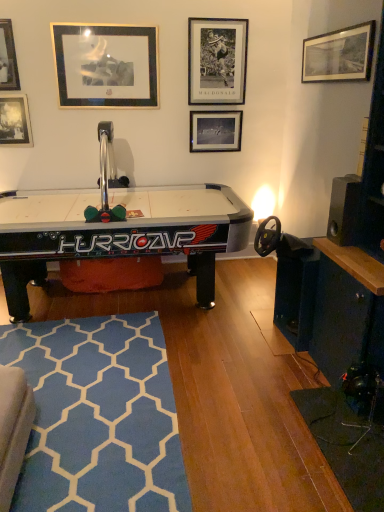
Measure the distance between point (12, 96) and camera.

The distance of point (12, 96) from camera is 11.77 feet.

At what (x,y) coordinates should I click in order to perform the action: click on blue textured rug at lower left. Please return your answer as a coordinate pair (x, y). This screenshot has width=384, height=512. Looking at the image, I should click on (98, 416).

What is the approximate width of black glossy air hockey table at center?

black glossy air hockey table at center is 1.28 meters wide.

How much space does black matte picture frame at center, which ranks as the third picture frame in right-to-left order, occupy vertically?

The height of black matte picture frame at center, which ranks as the third picture frame in right-to-left order, is 37.36 centimeters.

Image resolution: width=384 pixels, height=512 pixels. I want to click on metallic silver picture frame at upper center, placed as the 5th picture frame when sorted from left to right, so click(x=217, y=61).

Is black glossy air hockey table at center shorter than metallic silver picture frame at upper left, positioned as the 2th picture frame in left-to-right order?

No.

From a real-world perspective, does black glossy air hockey table at center stand above metallic silver picture frame at upper left, marked as the fifth picture frame in a right-to-left arrangement?

No.

Is black glossy air hockey table at center placed right next to metallic silver picture frame at upper left, positioned as the 2th picture frame in left-to-right order?

No, black glossy air hockey table at center is not with metallic silver picture frame at upper left, positioned as the 2th picture frame in left-to-right order.

From the image's perspective, which object appears higher, black glossy air hockey table at center or metallic silver picture frame at upper left, marked as the fifth picture frame in a right-to-left arrangement?

metallic silver picture frame at upper left, marked as the fifth picture frame in a right-to-left arrangement, from the image's perspective.

Is metallic silver picture frame at upper left, positioned as the 2th picture frame in left-to-right order, oriented towards gold/metallic picture frame at upper left, which is the 4th picture frame in right-to-left order?

No, metallic silver picture frame at upper left, positioned as the 2th picture frame in left-to-right order, is not aimed at gold/metallic picture frame at upper left, which is the 4th picture frame in right-to-left order.

Is metallic silver picture frame at upper left, positioned as the 2th picture frame in left-to-right order, at the right side of gold/metallic picture frame at upper left, the third picture frame from the left?

Incorrect, metallic silver picture frame at upper left, positioned as the 2th picture frame in left-to-right order, is not on the right side of gold/metallic picture frame at upper left, the third picture frame from the left.

Who is bigger, metallic silver picture frame at upper left, marked as the fifth picture frame in a right-to-left arrangement, or gold/metallic picture frame at upper left, which is the 4th picture frame in right-to-left order?

With larger size is gold/metallic picture frame at upper left, which is the 4th picture frame in right-to-left order.

Is metallic silver picture frame at upper center, placed as the 2th picture frame when sorted from right to left, not inside metallic silver picture frame at upper left, arranged as the first picture frame when viewed from the left?

Yes, metallic silver picture frame at upper center, placed as the 2th picture frame when sorted from right to left, is located beyond the bounds of metallic silver picture frame at upper left, arranged as the first picture frame when viewed from the left.

How many degrees apart are the facing directions of metallic silver picture frame at upper center, placed as the 5th picture frame when sorted from left to right, and metallic silver picture frame at upper left, which is the 6th picture frame from right to left?

0.0104 degrees.

Is point (236, 19) more distant than point (20, 142)?

That is False.

Who is smaller, metallic silver picture frame at upper center, placed as the 5th picture frame when sorted from left to right, or metallic silver picture frame at upper left, arranged as the first picture frame when viewed from the left?

metallic silver picture frame at upper left, arranged as the first picture frame when viewed from the left.

Is gold/metallic picture frame at upper left, the third picture frame from the left, bigger than black glossy air hockey table at center?

No.

What's the angular difference between gold/metallic picture frame at upper left, which is the 4th picture frame in right-to-left order, and black glossy air hockey table at center's facing directions?

The facing directions of gold/metallic picture frame at upper left, which is the 4th picture frame in right-to-left order, and black glossy air hockey table at center are 0.373 degrees apart.

Based on the photo, is gold/metallic picture frame at upper left, the third picture frame from the left, with black glossy air hockey table at center?

No.

Between gold/metallic picture frame at upper left, which is the 4th picture frame in right-to-left order, and black glossy air hockey table at center, which one is positioned in front?

Positioned in front is black glossy air hockey table at center.

Is black matte picture frame at center, which ranks as the third picture frame in right-to-left order, aimed at metallic silver picture frame at upper center, placed as the 2th picture frame when sorted from right to left?

No, black matte picture frame at center, which ranks as the third picture frame in right-to-left order, is not oriented towards metallic silver picture frame at upper center, placed as the 2th picture frame when sorted from right to left.

Does black matte picture frame at center, which ranks as the third picture frame in right-to-left order, have a lesser width compared to metallic silver picture frame at upper center, placed as the 2th picture frame when sorted from right to left?

Incorrect, the width of black matte picture frame at center, which ranks as the third picture frame in right-to-left order, is not less than that of metallic silver picture frame at upper center, placed as the 2th picture frame when sorted from right to left.

Can you confirm if black matte picture frame at center, which ranks as the third picture frame in right-to-left order, is taller than metallic silver picture frame at upper center, placed as the 2th picture frame when sorted from right to left?

In fact, black matte picture frame at center, which ranks as the third picture frame in right-to-left order, may be shorter than metallic silver picture frame at upper center, placed as the 2th picture frame when sorted from right to left.

Is point (218, 136) farther from camera compared to point (219, 70)?

Yes, it is.

Between gold/metallic picture frame at upper left, the third picture frame from the left, and black matte picture frame at center, marked as the fourth picture frame in a left-to-right arrangement, which one has more height?

gold/metallic picture frame at upper left, the third picture frame from the left, is taller.

Considering the relative sizes of gold/metallic picture frame at upper left, which is the 4th picture frame in right-to-left order, and black matte picture frame at center, marked as the fourth picture frame in a left-to-right arrangement, in the image provided, is gold/metallic picture frame at upper left, which is the 4th picture frame in right-to-left order, thinner than black matte picture frame at center, marked as the fourth picture frame in a left-to-right arrangement,?

Correct, the width of gold/metallic picture frame at upper left, which is the 4th picture frame in right-to-left order, is less than that of black matte picture frame at center, marked as the fourth picture frame in a left-to-right arrangement.

Between gold/metallic picture frame at upper left, which is the 4th picture frame in right-to-left order, and black matte picture frame at center, which ranks as the third picture frame in right-to-left order, which one appears on the left side from the viewer's perspective?

From the viewer's perspective, gold/metallic picture frame at upper left, which is the 4th picture frame in right-to-left order, appears more on the left side.

From a real-world perspective, count 2nd picture frames downward from the gold/metallic picture frame at upper left, which is the 4th picture frame in right-to-left order, and point to it. Please provide its 2D coordinates.

[(215, 131)]

Consider the image. Which is behind, metallic silver picture frame at upper center, placed as the 2th picture frame when sorted from right to left, or black matte picture frame at upper right, arranged as the 6th picture frame when viewed from the left?

metallic silver picture frame at upper center, placed as the 2th picture frame when sorted from right to left, is behind.

Considering the relative positions of metallic silver picture frame at upper center, placed as the 5th picture frame when sorted from left to right, and black matte picture frame at upper right, arranged as the 6th picture frame when viewed from the left, in the image provided, is metallic silver picture frame at upper center, placed as the 5th picture frame when sorted from left to right, to the right of black matte picture frame at upper right, arranged as the 6th picture frame when viewed from the left, from the viewer's perspective?

No, metallic silver picture frame at upper center, placed as the 5th picture frame when sorted from left to right, is not to the right of black matte picture frame at upper right, arranged as the 6th picture frame when viewed from the left.

Do you think metallic silver picture frame at upper center, placed as the 2th picture frame when sorted from right to left, is within black matte picture frame at upper right, arranged as the first picture frame when viewed from the right, or outside of it?

metallic silver picture frame at upper center, placed as the 2th picture frame when sorted from right to left, exists outside the volume of black matte picture frame at upper right, arranged as the first picture frame when viewed from the right.

Is metallic silver picture frame at upper center, placed as the 2th picture frame when sorted from right to left, far from black matte picture frame at upper right, arranged as the 6th picture frame when viewed from the left?

No, metallic silver picture frame at upper center, placed as the 2th picture frame when sorted from right to left, is not far away from black matte picture frame at upper right, arranged as the 6th picture frame when viewed from the left.

You are a GUI agent. You are given a task and a screenshot of the screen. Output one action in this format:
    pyautogui.click(x=<x>, y=<y>)
    Task: Click on the 2nd picture frame behind the black glossy air hockey table at center
    The height and width of the screenshot is (512, 384).
    Given the screenshot: What is the action you would take?
    pyautogui.click(x=8, y=58)

There is a gold/metallic picture frame at upper left, which is the 4th picture frame in right-to-left order. Where is `the 1st picture frame above it (from the image's perspective)`? the 1st picture frame above it (from the image's perspective) is located at coordinates tap(8, 58).

Which object lies further to the anchor point black matte picture frame at upper right, arranged as the 6th picture frame when viewed from the left, black matte picture frame at center, marked as the fourth picture frame in a left-to-right arrangement, or metallic silver picture frame at upper left, arranged as the first picture frame when viewed from the left?

metallic silver picture frame at upper left, arranged as the first picture frame when viewed from the left, is further to black matte picture frame at upper right, arranged as the 6th picture frame when viewed from the left.

Based on their spatial positions, is black glossy air hockey table at center or black matte picture frame at center, marked as the fourth picture frame in a left-to-right arrangement, closer to black matte picture frame at upper right, arranged as the 6th picture frame when viewed from the left?

Among the two, black matte picture frame at center, marked as the fourth picture frame in a left-to-right arrangement, is located nearer to black matte picture frame at upper right, arranged as the 6th picture frame when viewed from the left.

Based on their spatial positions, is metallic silver picture frame at upper left, positioned as the 2th picture frame in left-to-right order, or metallic silver picture frame at upper center, placed as the 5th picture frame when sorted from left to right, further from black matte picture frame at upper right, arranged as the first picture frame when viewed from the right?

The object further to black matte picture frame at upper right, arranged as the first picture frame when viewed from the right, is metallic silver picture frame at upper left, positioned as the 2th picture frame in left-to-right order.

Which object lies further to the anchor point metallic silver picture frame at upper left, marked as the fifth picture frame in a right-to-left arrangement, metallic silver picture frame at upper center, placed as the 5th picture frame when sorted from left to right, or gold/metallic picture frame at upper left, which is the 4th picture frame in right-to-left order?

metallic silver picture frame at upper center, placed as the 5th picture frame when sorted from left to right, is further to metallic silver picture frame at upper left, marked as the fifth picture frame in a right-to-left arrangement.

Estimate the real-world distances between objects in this image. Which object is further from black matte picture frame at center, marked as the fourth picture frame in a left-to-right arrangement, metallic silver picture frame at upper left, which is the 6th picture frame from right to left, or black matte picture frame at upper right, arranged as the 6th picture frame when viewed from the left?

metallic silver picture frame at upper left, which is the 6th picture frame from right to left, is further to black matte picture frame at center, marked as the fourth picture frame in a left-to-right arrangement.

When comparing their distances from gold/metallic picture frame at upper left, the third picture frame from the left, does black matte picture frame at upper right, arranged as the 6th picture frame when viewed from the left, or metallic silver picture frame at upper left, marked as the fifth picture frame in a right-to-left arrangement, seem further?

black matte picture frame at upper right, arranged as the 6th picture frame when viewed from the left, is further to gold/metallic picture frame at upper left, the third picture frame from the left.

Considering their positions, is metallic silver picture frame at upper left, arranged as the first picture frame when viewed from the left, positioned closer to blue textured rug at lower left than gold/metallic picture frame at upper left, which is the 4th picture frame in right-to-left order?

metallic silver picture frame at upper left, arranged as the first picture frame when viewed from the left, is positioned closer to the anchor blue textured rug at lower left.

From the image, which object appears to be nearer to metallic silver picture frame at upper left, positioned as the 2th picture frame in left-to-right order, blue textured rug at lower left or black matte picture frame at upper right, arranged as the first picture frame when viewed from the right?

black matte picture frame at upper right, arranged as the first picture frame when viewed from the right, lies closer to metallic silver picture frame at upper left, positioned as the 2th picture frame in left-to-right order, than the other object.

Identify the location of table located between metallic silver picture frame at upper left, arranged as the first picture frame when viewed from the left, and metallic silver picture frame at upper center, placed as the 2th picture frame when sorted from right to left, in the left-right direction. (118, 232).

You are a GUI agent. You are given a task and a screenshot of the screen. Output one action in this format:
    pyautogui.click(x=<x>, y=<y>)
    Task: Click on the table between metallic silver picture frame at upper left, marked as the fifth picture frame in a right-to-left arrangement, and black matte picture frame at upper right, arranged as the first picture frame when viewed from the right
    The width and height of the screenshot is (384, 512).
    Given the screenshot: What is the action you would take?
    pyautogui.click(x=118, y=232)

Find the location of a particular element. The width and height of the screenshot is (384, 512). picture frame between gold/metallic picture frame at upper left, the third picture frame from the left, and metallic silver picture frame at upper center, placed as the 2th picture frame when sorted from right to left, from left to right is located at coordinates (215, 131).

Identify the location of table between blue textured rug at lower left and black matte picture frame at center, which ranks as the third picture frame in right-to-left order, along the z-axis. The height and width of the screenshot is (512, 384). (118, 232).